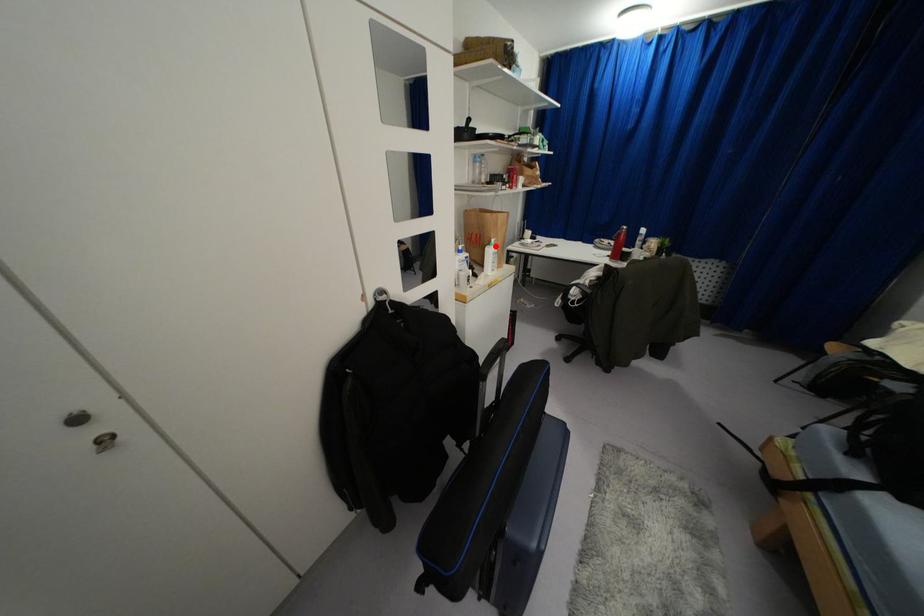
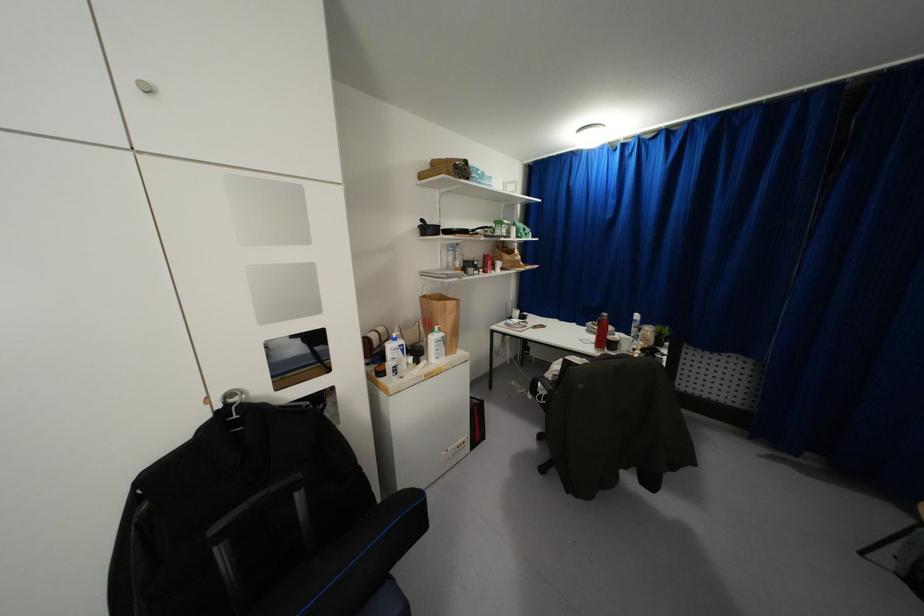
Question: I am providing you with two images of the same scene from different viewpoints. A red point is shown in image1. For the corresponding object point in image2, is it positioned nearer or farther from the camera?

Choices:
 (A) Nearer
 (B) Farther

Answer: (B)